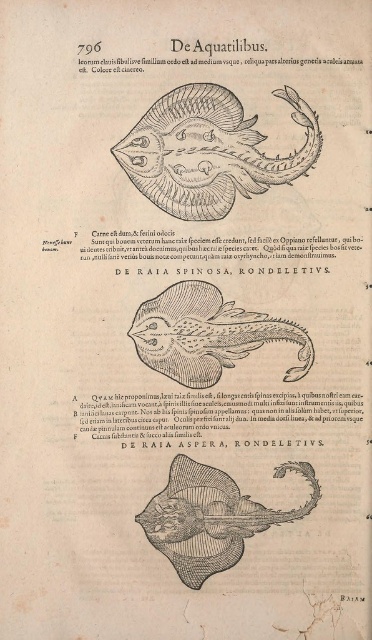
Can you confirm if gray etched ray at lower center is thinner than grayish matte ray at center?

Yes, gray etched ray at lower center is thinner than grayish matte ray at center.

Who is lower down, gray etched ray at lower center or grayish matte ray at center?

gray etched ray at lower center is below.

The image size is (372, 640). I want to click on gray etched ray at lower center, so pos(212,516).

Is gray etched ray at lower center shorter than black paper at lower center?

No.

Does gray etched ray at lower center appear on the right side of black paper at lower center?

Correct, you'll find gray etched ray at lower center to the right of black paper at lower center.

The image size is (372, 640). Describe the element at coordinates (212, 516) in the screenshot. I see `gray etched ray at lower center` at that location.

Locate an element on the screen. The image size is (372, 640). gray etched ray at lower center is located at coordinates (212, 516).

Can you confirm if gray etched ray at lower center is positioned below black paper at lower right?

Incorrect, gray etched ray at lower center is not positioned below black paper at lower right.

Does point (193, 481) come farther from viewer compared to point (363, 598)?

Yes.

Locate an element on the screen. gray etched ray at lower center is located at coordinates coord(212,516).